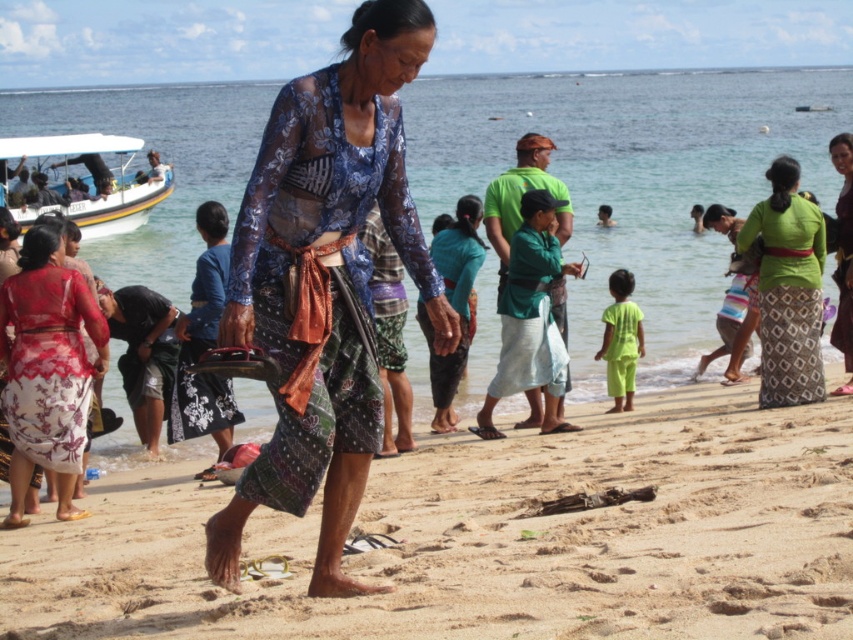
Is batik fabric dress at center above translucent floral dress at lower left?

Yes.

Measure the distance from batik fabric dress at center to translucent floral dress at lower left.

batik fabric dress at center and translucent floral dress at lower left are 1.91 meters apart from each other.

What do you see at coordinates (325, 284) in the screenshot? The height and width of the screenshot is (640, 853). I see `batik fabric dress at center` at bounding box center [325, 284].

Locate an element on the screen. batik fabric dress at center is located at coordinates (325, 284).

Is clear blue water at center to the right of translucent floral dress at lower left from the viewer's perspective?

In fact, clear blue water at center is to the left of translucent floral dress at lower left.

Based on the photo, is clear blue water at center taller than translucent floral dress at lower left?

Yes, clear blue water at center is taller than translucent floral dress at lower left.

Which is in front, point (695, 257) or point (55, 396)?

Positioned in front is point (55, 396).

The height and width of the screenshot is (640, 853). In order to click on clear blue water at center in this screenshot , I will do pos(633,177).

Who is higher up, batik fabric dress at center or matte green skirt at center?

Positioned higher is matte green skirt at center.

Which is in front, point (271, 205) or point (833, 390)?

Point (271, 205) is more forward.

Find the location of a particular element. The image size is (853, 640). batik fabric dress at center is located at coordinates (325, 284).